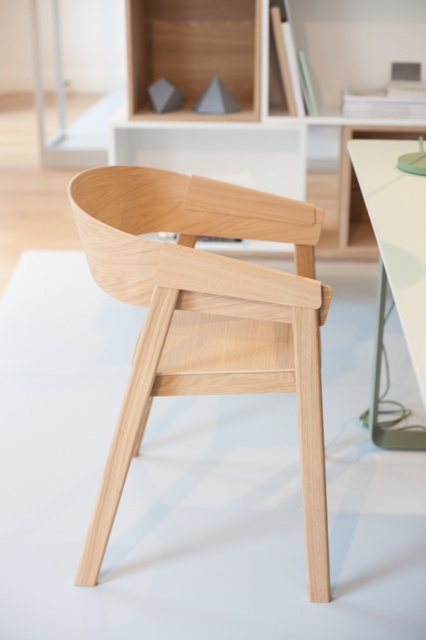
The image size is (426, 640). What are the coordinates of `natural wood chair at center` in the screenshot? It's located at (206, 320).

Who is more forward, (276, 294) or (423, 184)?

Point (276, 294) is in front.

Identify the location of natural wood chair at center. The width and height of the screenshot is (426, 640). (206, 320).